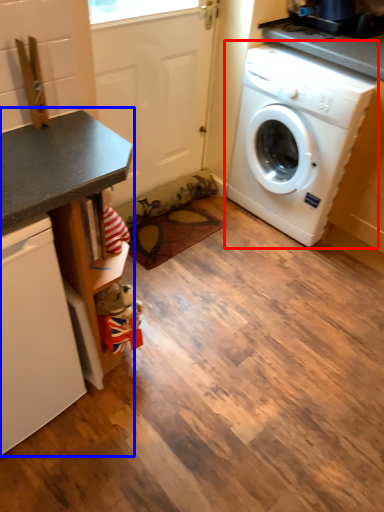
Question: Among these objects, which one is farthest to the camera, washing machine (highlighted by a red box) or counter (highlighted by a blue box)?

Choices:
 (A) washing machine
 (B) counter

Answer: (A)